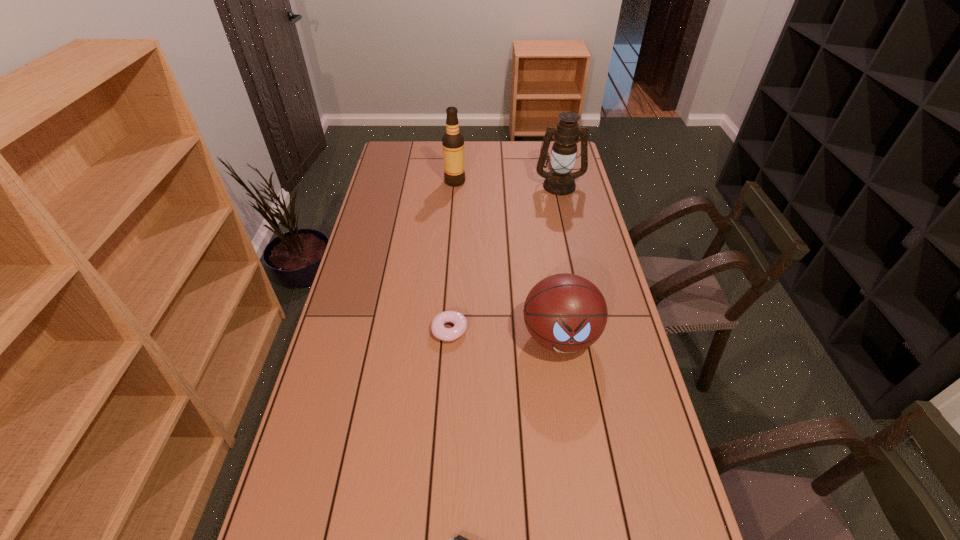
At what (x,y) coordinates should I click in order to perform the action: click on alcohol. Please return your answer as a coordinate pair (x, y). Looking at the image, I should click on (453, 141).

The width and height of the screenshot is (960, 540). I want to click on oil lamp, so click(559, 181).

Locate an element on the screen. basketball is located at coordinates (566, 313).

You are a GUI agent. You are given a task and a screenshot of the screen. Output one action in this format:
    pyautogui.click(x=<x>, y=<y>)
    Task: Click on the fourth tallest object
    The height and width of the screenshot is (540, 960).
    Given the screenshot: What is the action you would take?
    pyautogui.click(x=439, y=331)

You are a GUI agent. You are given a task and a screenshot of the screen. Output one action in this format:
    pyautogui.click(x=<x>, y=<y>)
    Task: Click on the vacant space located on the label of the alcohol
    The width and height of the screenshot is (960, 540).
    Given the screenshot: What is the action you would take?
    pyautogui.click(x=508, y=181)

Find the location of `vacant position located 0.160m on the left of the oil lamp`. vacant position located 0.160m on the left of the oil lamp is located at coordinates (498, 185).

Find the location of a particular element. This screenshot has height=540, width=960. vacant space located 0.260m on the back of the basketball is located at coordinates (547, 255).

At what (x,y) coordinates should I click in order to perform the action: click on free space located on the back of the second shortest object. Please return your answer as a coordinate pair (x, y). This screenshot has width=960, height=540. Looking at the image, I should click on (453, 271).

Locate an element on the screen. The height and width of the screenshot is (540, 960). oil lamp that is at the right edge is located at coordinates pos(559,181).

At what (x,y) coordinates should I click in order to perform the action: click on basketball situated at the right edge. Please return your answer as a coordinate pair (x, y). This screenshot has height=540, width=960. Looking at the image, I should click on [x=566, y=313].